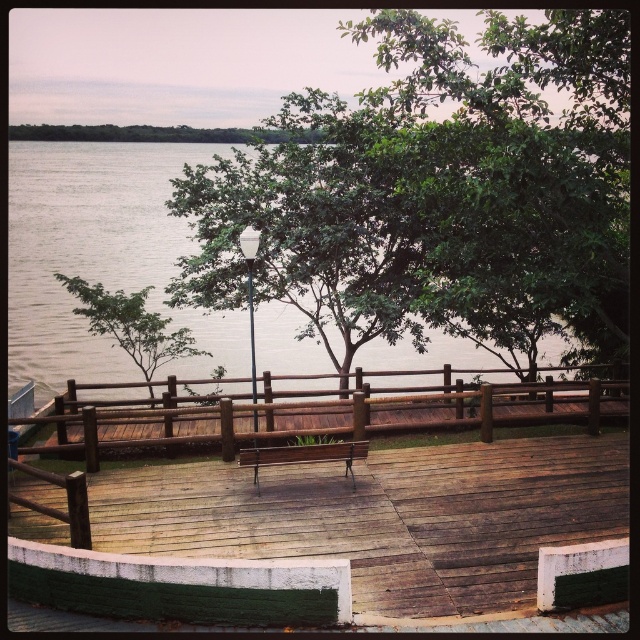
Is green leafy tree at left positioned at the back of wooden bench at center?

That is True.

Who is more distant from viewer, (88, 317) or (296, 452)?

The point (88, 317) is more distant.

Is point (122, 301) positioned before point (353, 451)?

That is False.

Find the location of a particular element. Image resolution: width=640 pixels, height=640 pixels. green leafy tree at left is located at coordinates (131, 323).

Which of these two, green leafy tree at center or green leafy tree at left, stands taller?

With more height is green leafy tree at center.

Does green leafy tree at center have a greater height compared to green leafy tree at left?

Yes, green leafy tree at center is taller than green leafy tree at left.

The image size is (640, 640). What are the coordinates of `green leafy tree at center` in the screenshot? It's located at (440, 193).

Is brown water at center behind brown wooden rail at center?

Yes, it is.

Between brown water at center and brown wooden rail at center, which one appears on the right side from the viewer's perspective?

brown wooden rail at center

Is point (29, 241) positioned behind point (324, 403)?

Yes, point (29, 241) is farther from viewer.

I want to click on brown water at center, so click(100, 259).